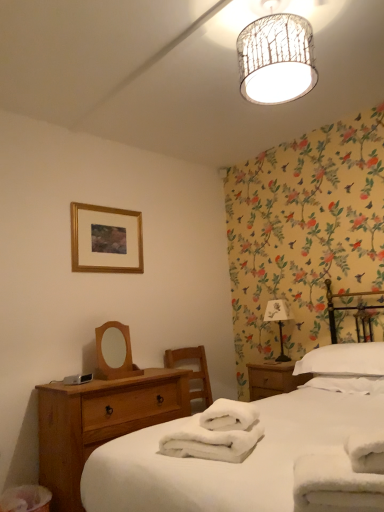
Identify the location of white soft towel at right, the third bath towel viewed from the front. (347, 384).

Locate an element on the screen. The width and height of the screenshot is (384, 512). white textured lampshade at upper center is located at coordinates (276, 59).

In order to face white cotton bed at left, should I rotate leftwards or rightwards?

It's best to rotate right around 18.695 degrees.

Image resolution: width=384 pixels, height=512 pixels. Describe the element at coordinates (250, 460) in the screenshot. I see `white cotton bed at left` at that location.

At what (x,y) coordinates should I click in order to perform the action: click on white fluffy bath towel at lower right, which is the 2th bath towel in right-to-left order. Please return your answer as a coordinate pair (x, y). Looking at the image, I should click on (343, 476).

What is the approximate height of white fluffy bath towel at lower right, positioned as the first bath towel in front-to-back order?

white fluffy bath towel at lower right, positioned as the first bath towel in front-to-back order, is 5.76 inches in height.

From the picture: Measure the distance between white fabric-covered table lamp at right and camera.

white fabric-covered table lamp at right is 3.37 meters away from camera.

What do you see at coordinates (217, 433) in the screenshot? The width and height of the screenshot is (384, 512). I see `white fluffy bath towel at center, the third bath towel when ordered from right to left` at bounding box center [217, 433].

Locate an element on the screen. white soft towel at right, which appears as the third bath towel when viewed from the left is located at coordinates (347, 384).

Locate an element on the screen. nightstand below the white fluffy bath towel at center, the third bath towel when ordered from right to left (from the image's perspective) is located at coordinates (100, 422).

Does point (61, 422) lie behind point (194, 437)?

Yes, point (61, 422) is farther from viewer.

Would you say light brown wood at lower left is outside white fluffy bath towel at center, marked as the second bath towel in a back-to-front arrangement?

light brown wood at lower left is positioned outside white fluffy bath towel at center, marked as the second bath towel in a back-to-front arrangement.

Looking at the image, does white fluffy bath towel at lower right, acting as the 2th bath towel starting from the left, seem bigger or smaller compared to gold-framed picture at upper left?

Clearly, white fluffy bath towel at lower right, acting as the 2th bath towel starting from the left, is smaller in size than gold-framed picture at upper left.

Could you tell me if white fluffy bath towel at lower right, positioned as the third bath towel in back-to-front order, is turned towards gold-framed picture at upper left?

No.

Which of these two, white fluffy bath towel at lower right, positioned as the first bath towel in front-to-back order, or gold-framed picture at upper left, stands shorter?

white fluffy bath towel at lower right, positioned as the first bath towel in front-to-back order, is shorter.

You are a GUI agent. You are given a task and a screenshot of the screen. Output one action in this format:
    pyautogui.click(x=<x>, y=<y>)
    Task: Click on the pillow lying below the wooden mirror at left (from the image's perspective)
    This screenshot has width=384, height=512.
    Given the screenshot: What is the action you would take?
    pyautogui.click(x=344, y=360)

Is white soft pillow at right turned away from wooden mirror at left?

No, white soft pillow at right's orientation is not away from wooden mirror at left.

Can you see white soft pillow at right touching wooden mirror at left?

white soft pillow at right is not next to wooden mirror at left, and they're not touching.

Choose the correct answer: Is white soft pillow at right inside wooden mirror at left or outside it?

white soft pillow at right cannot be found inside wooden mirror at left.

Is white soft towel at right, the 1th bath towel when ordered from right to left, spatially inside white textured lampshade at upper center, or outside of it?

white soft towel at right, the 1th bath towel when ordered from right to left, cannot be found inside white textured lampshade at upper center.

Can you tell me how much white soft towel at right, the third bath towel viewed from the front, and white textured lampshade at upper center differ in facing direction?

The angular difference between white soft towel at right, the third bath towel viewed from the front, and white textured lampshade at upper center is 1.87 degrees.

Can you confirm if white soft towel at right, the 1th bath towel when ordered from right to left, is smaller than white textured lampshade at upper center?

Yes, white soft towel at right, the 1th bath towel when ordered from right to left, is smaller than white textured lampshade at upper center.

I want to click on lamp above the white soft towel at right, the 1th bath towel when ordered from back to front (from the image's perspective), so click(x=276, y=59).

Do you think white textured lampshade at upper center is within white fluffy bath towel at center, positioned as the 2th bath towel in front-to-back order, or outside of it?

white textured lampshade at upper center lies outside white fluffy bath towel at center, positioned as the 2th bath towel in front-to-back order.

From a real-world perspective, which object rests below the other?

white fluffy bath towel at center, positioned as the 2th bath towel in front-to-back order.

The height and width of the screenshot is (512, 384). Find the location of `lamp above the white fluffy bath towel at center, the third bath towel when ordered from right to left (from the image's perspective)`. lamp above the white fluffy bath towel at center, the third bath towel when ordered from right to left (from the image's perspective) is located at coordinates (276, 59).

Is white textured lampshade at upper center bigger than white fluffy bath towel at center, the third bath towel when ordered from right to left?

Correct, white textured lampshade at upper center is larger in size than white fluffy bath towel at center, the third bath towel when ordered from right to left.

From the image's perspective, is gold-framed picture at upper left under white textured lampshade at upper center?

Yes, from the image's perspective, gold-framed picture at upper left is below white textured lampshade at upper center.

From a real-world perspective, between gold-framed picture at upper left and white textured lampshade at upper center, who is vertically higher?

In real-world perspective, white textured lampshade at upper center is above.

Is gold-framed picture at upper left facing away from white textured lampshade at upper center?

No, gold-framed picture at upper left is not facing away from white textured lampshade at upper center.

Does point (99, 218) come in front of point (257, 46)?

No, (99, 218) is further to viewer.

Considering the sizes of objects white soft pillow at right and white fabric-covered table lamp at right in the image provided, who is bigger, white soft pillow at right or white fabric-covered table lamp at right?

white soft pillow at right is bigger.

Can you confirm if white soft pillow at right is taller than white fabric-covered table lamp at right?

No.

Consider the image. Between white soft pillow at right and white fabric-covered table lamp at right, which one has larger width?

white soft pillow at right.

Where is `pillow below the white fabric-covered table lamp at right (from the image's perspective)`? The width and height of the screenshot is (384, 512). pillow below the white fabric-covered table lamp at right (from the image's perspective) is located at coordinates (344, 360).

This screenshot has height=512, width=384. In order to click on the 2nd bath towel above when counting from the light brown wood at lower left (from the image's perspective) in this screenshot , I will do `click(217, 433)`.

The height and width of the screenshot is (512, 384). In order to click on the 2nd bath towel to the right when counting from the gold-framed picture at upper left in this screenshot , I will do `click(343, 476)`.

From the image, which object appears to be farther from white soft pillow at right, white fluffy bath towel at lower right, which is the 2th bath towel in right-to-left order, or white fluffy bath towel at center, positioned as the 2th bath towel in front-to-back order?

Among the two, white fluffy bath towel at lower right, which is the 2th bath towel in right-to-left order, is located further to white soft pillow at right.

From the image, which object appears to be nearer to white fluffy bath towel at center, the 1th bath towel viewed from the left, light brown wood at lower left or white cotton bed at left?

white cotton bed at left lies closer to white fluffy bath towel at center, the 1th bath towel viewed from the left, than the other object.

From the picture: Looking at the image, which one is located further to white textured lampshade at upper center, white fluffy bath towel at center, the third bath towel when ordered from right to left, or white soft towel at right, the 1th bath towel when ordered from back to front?

white soft towel at right, the 1th bath towel when ordered from back to front, lies further to white textured lampshade at upper center than the other object.

Considering their positions, is white soft towel at right, the 1th bath towel when ordered from back to front, positioned further to white fluffy bath towel at center, positioned as the 2th bath towel in front-to-back order, than white fabric-covered table lamp at right?

Based on the image, white fabric-covered table lamp at right appears to be further to white fluffy bath towel at center, positioned as the 2th bath towel in front-to-back order.

When comparing their distances from white cotton bed at left, does light brown wood at lower left or white soft towel at right, the third bath towel viewed from the front, seem closer?

white soft towel at right, the third bath towel viewed from the front, is positioned closer to the anchor white cotton bed at left.

Considering their positions, is white fabric-covered table lamp at right positioned closer to wooden mirror at left than white soft pillow at right?

The object closer to wooden mirror at left is white soft pillow at right.

When comparing their distances from white fluffy bath towel at center, positioned as the 2th bath towel in front-to-back order, does white textured lampshade at upper center or gold-framed picture at upper left seem further?

gold-framed picture at upper left.

Based on their spatial positions, is white soft pillow at right or white fluffy bath towel at lower right, positioned as the third bath towel in back-to-front order, closer to white textured lampshade at upper center?

Based on the image, white fluffy bath towel at lower right, positioned as the third bath towel in back-to-front order, appears to be nearer to white textured lampshade at upper center.

Identify the location of mirror located between white fluffy bath towel at lower right, positioned as the third bath towel in back-to-front order, and white fabric-covered table lamp at right in the depth direction. The width and height of the screenshot is (384, 512). (114, 352).

This screenshot has height=512, width=384. I want to click on pillow between white cotton bed at left and gold-framed picture at upper left in the front-back direction, so click(344, 360).

Find the location of a particular element. nightstand located between gold-framed picture at upper left and white soft pillow at right in the left-right direction is located at coordinates (100, 422).

Where is `lamp between gold-framed picture at upper left and white soft pillow at right`? The height and width of the screenshot is (512, 384). lamp between gold-framed picture at upper left and white soft pillow at right is located at coordinates (276, 59).